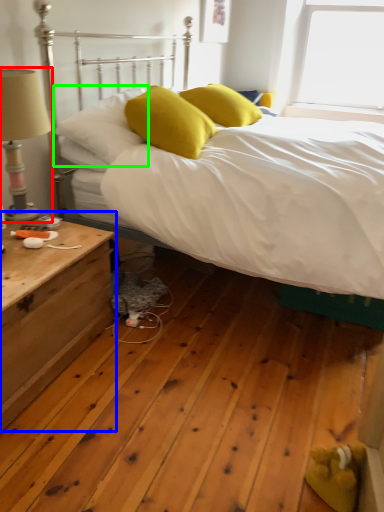
Question: Which object is the closest to the table lamp (highlighted by a red box)? Choose among these: nightstand (highlighted by a blue box) or pillow (highlighted by a green box).

Choices:
 (A) nightstand
 (B) pillow

Answer: (B)